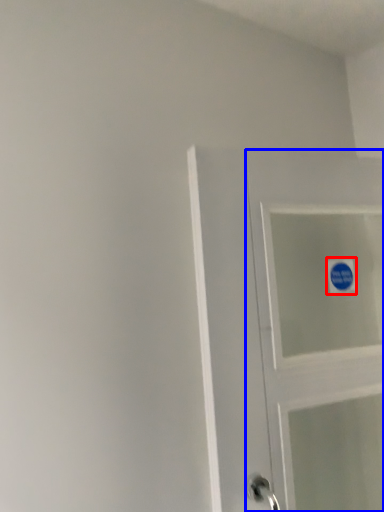
Question: Which point is further to the camera, sticker (highlighted by a red box) or door (highlighted by a blue box)?

Choices:
 (A) sticker
 (B) door

Answer: (A)